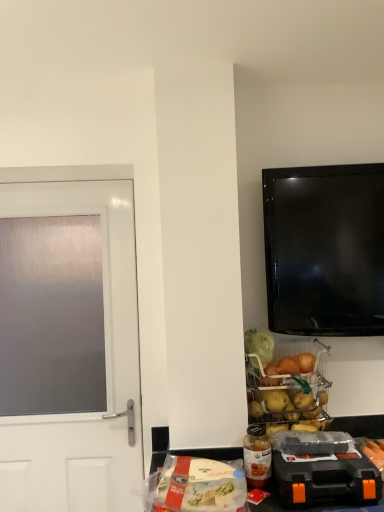
Question: From the image's perspective, is translucent plastic bottle at lower center located above or below orange plastic toolbox at lower right, placed as the first appliance when sorted from bottom to top?

Choices:
 (A) above
 (B) below

Answer: (A)

Question: Considering the relative positions of translucent plastic bottle at lower center and orange plastic toolbox at lower right, the second appliance when ordered from top to bottom, in the image provided, is translucent plastic bottle at lower center to the left or to the right of orange plastic toolbox at lower right, the second appliance when ordered from top to bottom,?

Choices:
 (A) right
 (B) left

Answer: (B)

Question: Considering the real-world distances, which object is farthest from the translucent plastic bag of pasta at lower center?

Choices:
 (A) satin white door at left
 (B) metallic wire basket at lower center, the 2th appliance when ordered from front to back
 (C) orange plastic toolbox at lower right, the 2th appliance viewed from the back
 (D) translucent plastic bottle at lower center

Answer: (A)

Question: Which object is positioned farthest from the orange plastic toolbox at lower right, which appears as the first appliance when viewed from the front?

Choices:
 (A) translucent plastic bag of pasta at lower center
 (B) metallic wire basket at lower center, which appears as the second appliance when ordered from the bottom
 (C) satin white door at left
 (D) translucent plastic bottle at lower center

Answer: (C)